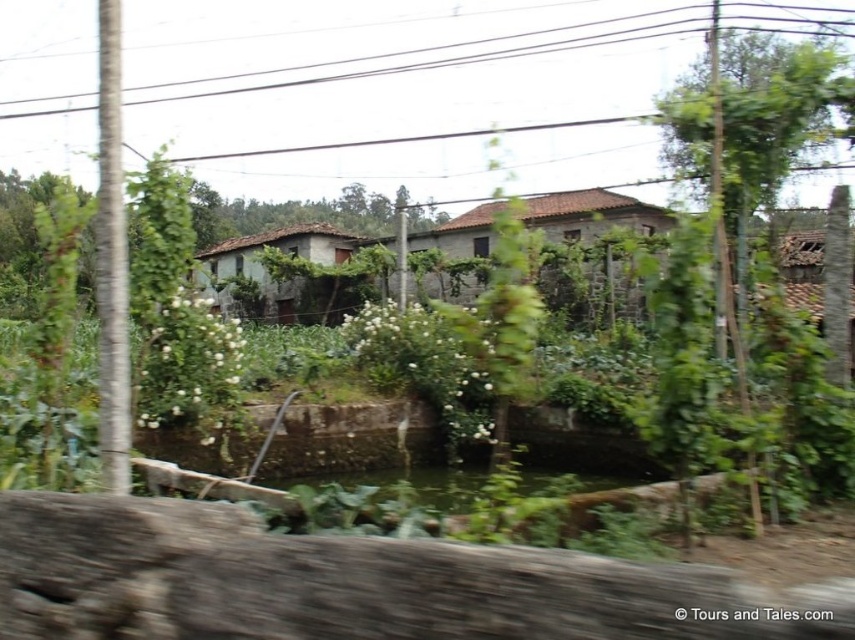
Question: Can you confirm if stone textured house at center is positioned below rustic stone house at center?

Choices:
 (A) no
 (B) yes

Answer: (B)

Question: Which of these objects is positioned closest to the stone textured house at center?

Choices:
 (A) black wire at upper center
 (B) rustic stone house at center

Answer: (B)

Question: Which of the following is the farthest from the observer?

Choices:
 (A) (320, 67)
 (B) (452, 237)

Answer: (A)

Question: Is the position of stone textured house at center less distant than that of rustic stone house at center?

Choices:
 (A) no
 (B) yes

Answer: (B)

Question: Where is black wire at upper center located in relation to stone textured house at center in the image?

Choices:
 (A) left
 (B) right

Answer: (A)

Question: Which point is farther to the camera?

Choices:
 (A) (550, 280)
 (B) (372, 74)

Answer: (B)